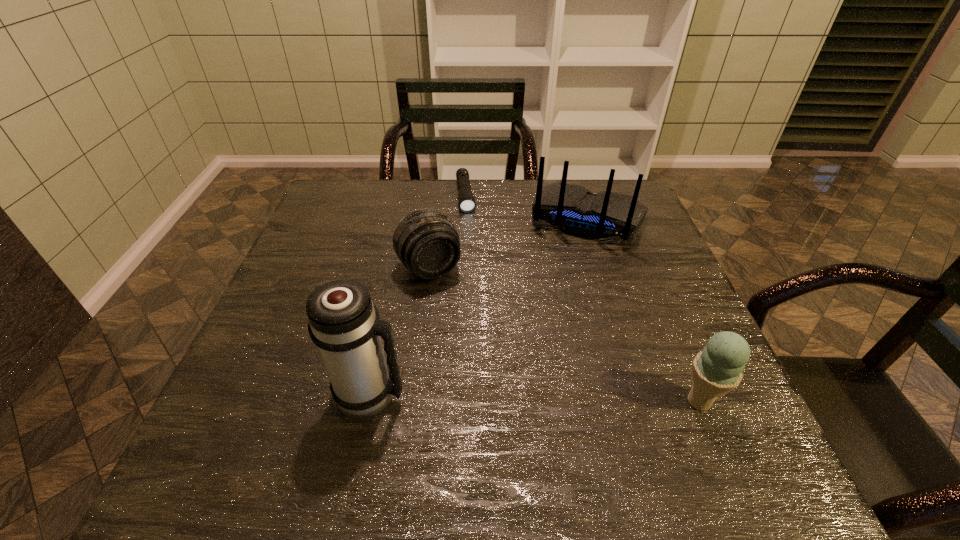
Find the location of a particular element. The image size is (960, 540). free space on the desktop that is between the thermos bottle and the ice cream and is positioned at the front element of the telephoto lens is located at coordinates pos(507,397).

Identify the location of vacant space on the desktop that is between the thermos bottle and the ice cream and is positioned on the back of the fourth shortest object. click(x=522, y=397).

I want to click on free space on the desktop that is between the tallest object and the third tallest object and is positioned at the lens end of the flashlight, so click(498, 397).